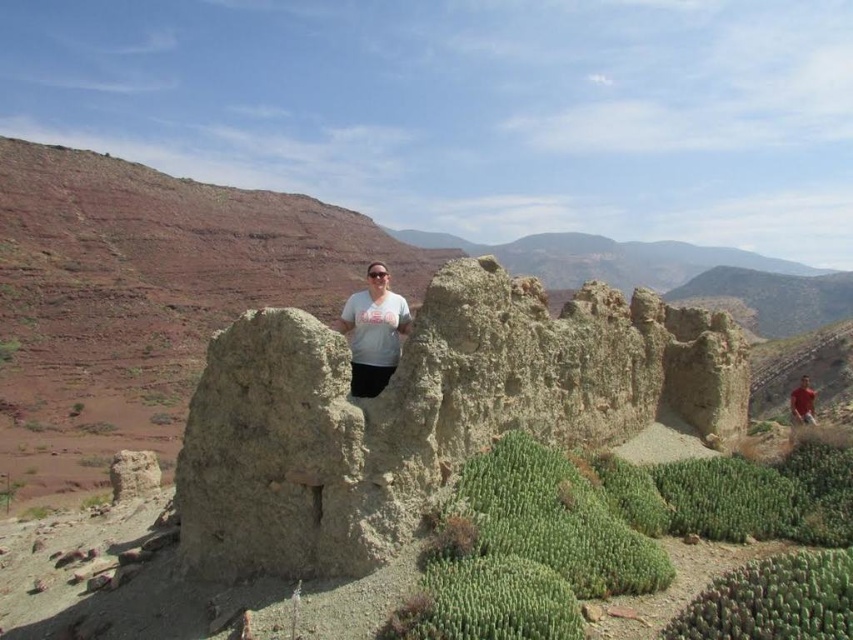
Question: Among these objects, which one is nearest to the camera?

Choices:
 (A) white cotton t-shirt at center
 (B) green spiky cactus at lower right
 (C) green succulent at center
 (D) rustic stone structure at center

Answer: (B)

Question: Is light beige stone wall at center to the left of green spiky cactus at lower right from the viewer's perspective?

Choices:
 (A) no
 (B) yes

Answer: (B)

Question: Is rustic stone structure at center closer to the viewer compared to green spiky cactus at lower right?

Choices:
 (A) yes
 (B) no

Answer: (B)

Question: Among these objects, which one is nearest to the camera?

Choices:
 (A) rustic stone structure at center
 (B) light beige stone wall at center
 (C) red cotton shirt at right
 (D) white cotton t-shirt at center

Answer: (B)

Question: Is green succulent at center to the left of green spiky cactus at lower right from the viewer's perspective?

Choices:
 (A) yes
 (B) no

Answer: (B)

Question: Considering the real-world distances, which object is closest to the rustic stone structure at center?

Choices:
 (A) light beige stone wall at center
 (B) green succulent at center
 (C) red cotton shirt at right
 (D) white cotton t-shirt at center

Answer: (A)